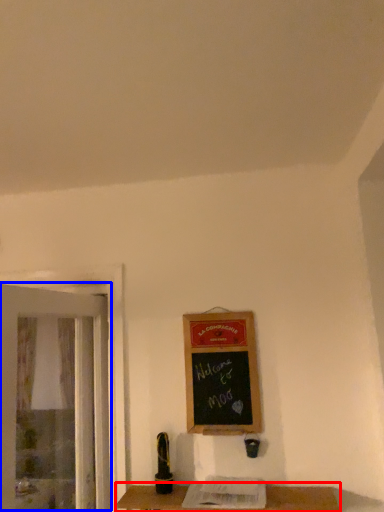
Question: Which point is closer to the camera, table (highlighted by a red box) or screen door (highlighted by a blue box)?

Choices:
 (A) table
 (B) screen door

Answer: (B)